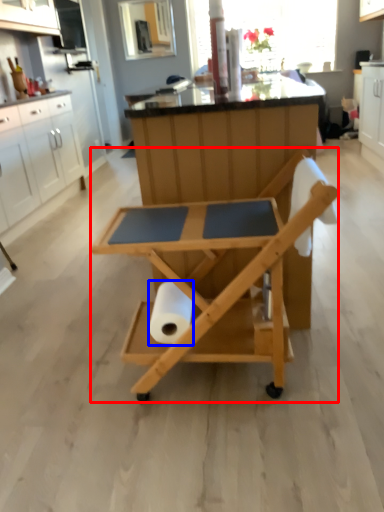
Question: Which point is further to the camera, table (highlighted by a red box) or paper towel (highlighted by a blue box)?

Choices:
 (A) table
 (B) paper towel

Answer: (B)